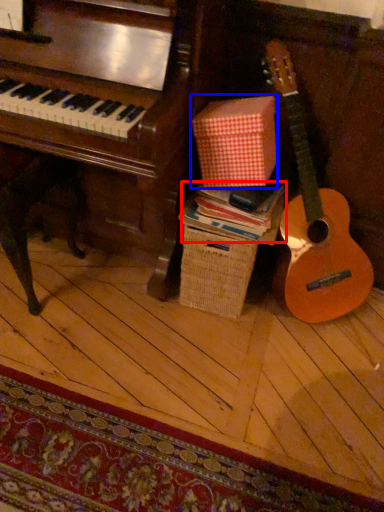
Question: Which object appears farthest to the camera in this image, book (highlighted by a red box) or cardboard box (highlighted by a blue box)?

Choices:
 (A) book
 (B) cardboard box

Answer: (A)